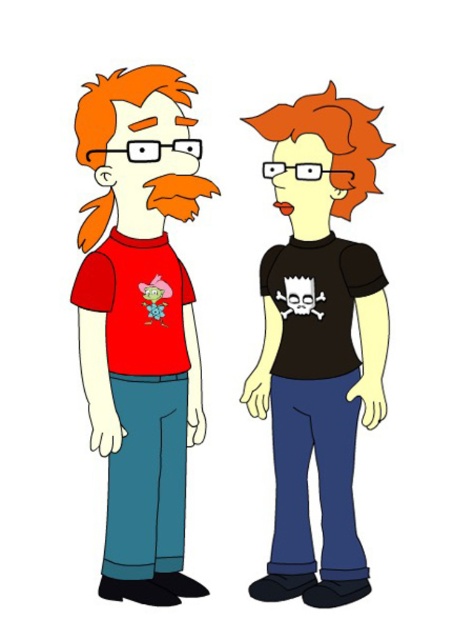
Question: Does black matte t-shirt at center appear on the right side of matte black skull at center?

Choices:
 (A) no
 (B) yes

Answer: (B)

Question: Does black matte t-shirt at center have a greater width compared to matte black skull at center?

Choices:
 (A) no
 (B) yes

Answer: (B)

Question: Which object is closer to the camera taking this photo?

Choices:
 (A) matte red t-shirt at left
 (B) matte black skull at center

Answer: (A)

Question: Does matte red t-shirt at left appear under matte black skull at center?

Choices:
 (A) no
 (B) yes

Answer: (B)

Question: Among these objects, which one is nearest to the camera?

Choices:
 (A) matte red t-shirt at left
 (B) black matte t-shirt at center

Answer: (A)

Question: Which of the following is the closest to the observer?

Choices:
 (A) black matte t-shirt at center
 (B) matte black skull at center

Answer: (A)